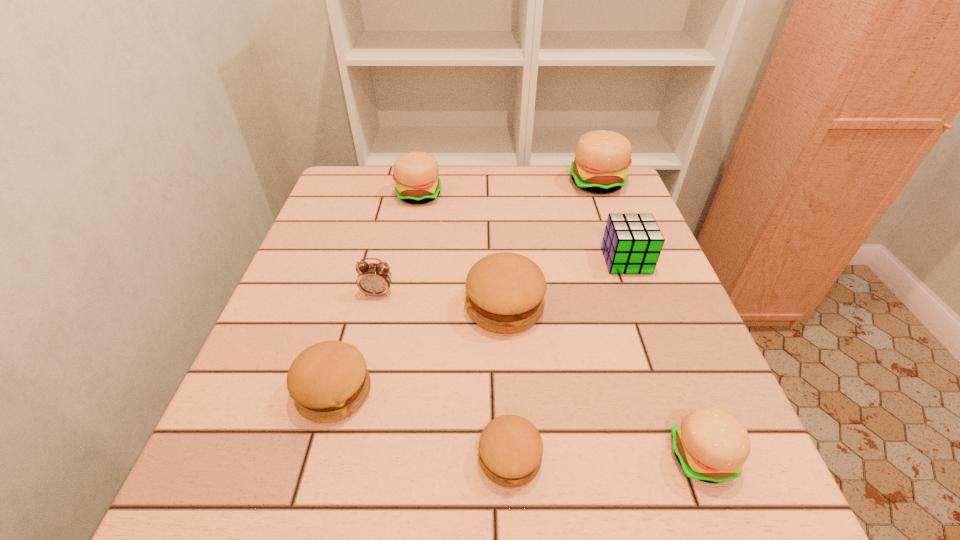
Image resolution: width=960 pixels, height=540 pixels. I want to click on the biggest beige hamburger, so click(x=602, y=158).

The width and height of the screenshot is (960, 540). I want to click on the tallest object, so click(x=602, y=158).

The image size is (960, 540). I want to click on the second smallest beige hamburger, so click(x=415, y=174).

Where is `the biggest brown hamburger`? The image size is (960, 540). the biggest brown hamburger is located at coordinates (505, 291).

The image size is (960, 540). I want to click on the farthest brown hamburger, so click(x=505, y=291).

The height and width of the screenshot is (540, 960). I want to click on cube, so click(x=632, y=243).

The height and width of the screenshot is (540, 960). I want to click on the sixth nearest object, so click(x=632, y=243).

Find the location of a particular element. alarm clock is located at coordinates (375, 279).

This screenshot has width=960, height=540. What are the coordinates of `the third nearest hamburger` in the screenshot? It's located at pyautogui.click(x=328, y=381).

Identify the location of the sixth farthest object. (328, 381).